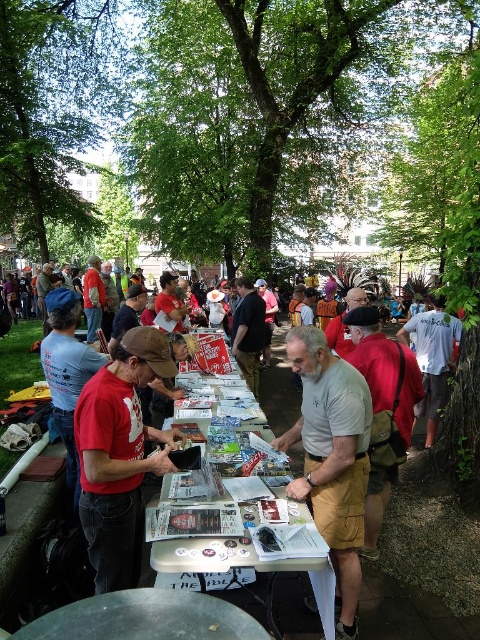
Is red cotton shirt at center in front of white glossy table at center?

No, red cotton shirt at center is further to the viewer.

Can you confirm if red cotton shirt at center is positioned below white glossy table at center?

No.

This screenshot has height=640, width=480. Find the location of `red cotton shirt at center`. red cotton shirt at center is located at coordinates (384, 369).

Does matte red t-shirt at center appear over white cotton shirt at center?

Actually, matte red t-shirt at center is below white cotton shirt at center.

Does matte red t-shirt at center have a greater width compared to white cotton shirt at center?

Incorrect, matte red t-shirt at center's width does not surpass white cotton shirt at center's.

Does point (128, 572) come in front of point (432, 349)?

Yes.

Identify the location of matte red t-shirt at center. This screenshot has width=480, height=640. (120, 456).

Can you confirm if white cotton shirt at center is thinner than white glossy table at center?

Indeed, white cotton shirt at center has a lesser width compared to white glossy table at center.

Can you confirm if white cotton shirt at center is positioned to the left of white glossy table at center?

Incorrect, white cotton shirt at center is not on the left side of white glossy table at center.

Is point (420, 358) farther from camera compared to point (275, 410)?

No, it is in front of (275, 410).

This screenshot has height=640, width=480. What are the coordinates of `white cotton shirt at center` in the screenshot? It's located at (432, 358).